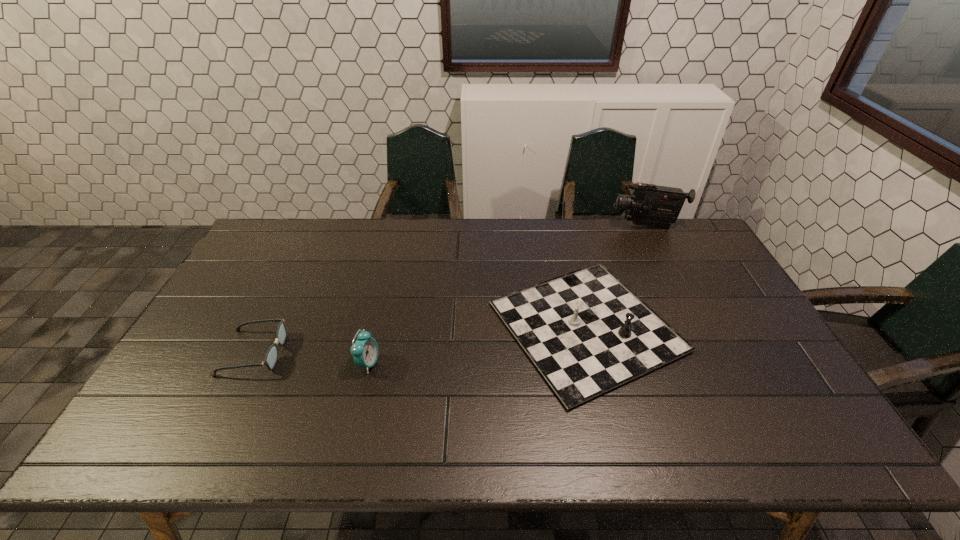
The width and height of the screenshot is (960, 540). I want to click on blank space located on the face of the alarm clock, so click(x=504, y=363).

Where is `free space located 0.210m on the back of the gameboard`? The height and width of the screenshot is (540, 960). free space located 0.210m on the back of the gameboard is located at coordinates (563, 230).

Identify the location of blank space located on the face of the spectacles. (320, 352).

This screenshot has height=540, width=960. I want to click on object that is at the far edge, so click(649, 205).

This screenshot has height=540, width=960. I want to click on object situated at the left edge, so click(x=271, y=357).

This screenshot has height=540, width=960. What are the coordinates of `object located at the right edge` in the screenshot? It's located at (649, 205).

This screenshot has height=540, width=960. Identify the location of object at the far right corner. (649, 205).

At what (x,y) coordinates should I click in order to perform the action: click on vacant space at the far edge. Please return your answer as a coordinate pair (x, y). Looking at the image, I should click on (426, 253).

In order to click on vacant space at the left edge in this screenshot , I will do `click(228, 375)`.

Locate an element on the screen. vacant position at the right edge of the desktop is located at coordinates (734, 289).